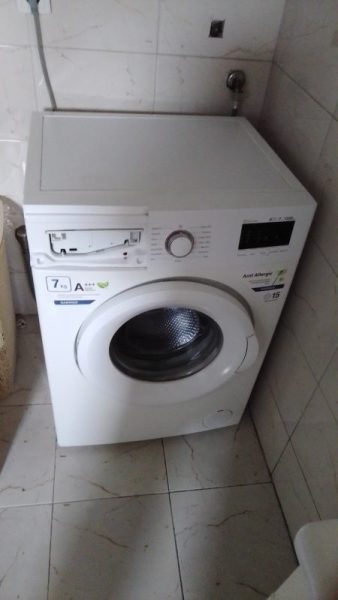
Locate an element on the screen. This screenshot has width=338, height=600. display panel is located at coordinates (x=275, y=234).